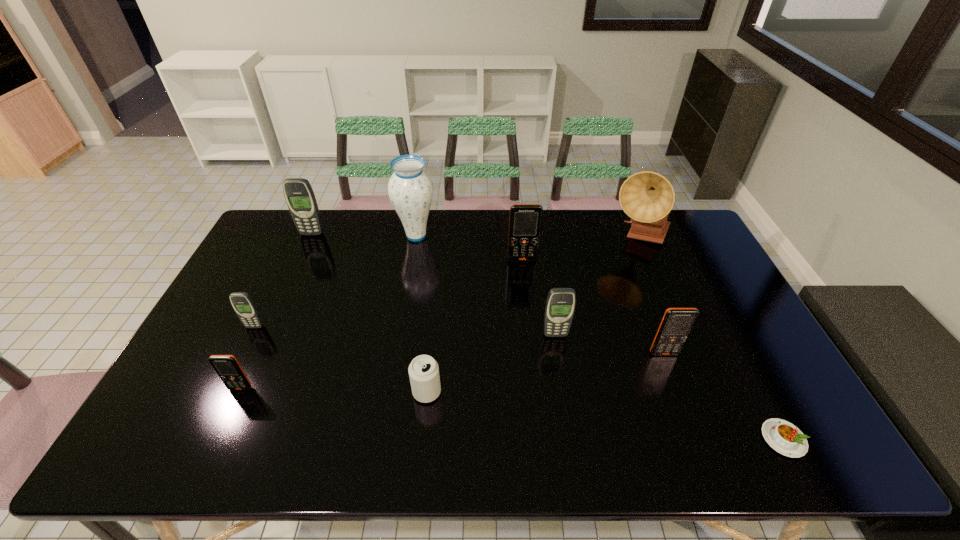
Find the location of `phonograph record located at the right edge`. phonograph record located at the right edge is located at coordinates point(647,197).

Find the location of a particular element. pudding situated at the right edge is located at coordinates 784,437.

What are the coordinates of `object situated at the far left corner` in the screenshot? It's located at (299, 195).

The image size is (960, 540). In order to click on object located in the far right corner section of the desktop in this screenshot , I will do `click(647, 197)`.

Identify the location of object present at the near right corner. (784, 437).

Locate an element on the screen. This screenshot has height=540, width=960. vacant space at the far edge is located at coordinates (488, 234).

The image size is (960, 540). I want to click on free location at the near edge of the desktop, so click(x=466, y=459).

In order to click on free region at the right edge in this screenshot , I will do `click(694, 282)`.

At what (x,y) coordinates should I click in order to perform the action: click on blank area at the far left corner. Please return your answer as a coordinate pair (x, y). The width and height of the screenshot is (960, 540). Looking at the image, I should click on (274, 215).

This screenshot has width=960, height=540. Identify the location of free space at the near left corner. (209, 429).